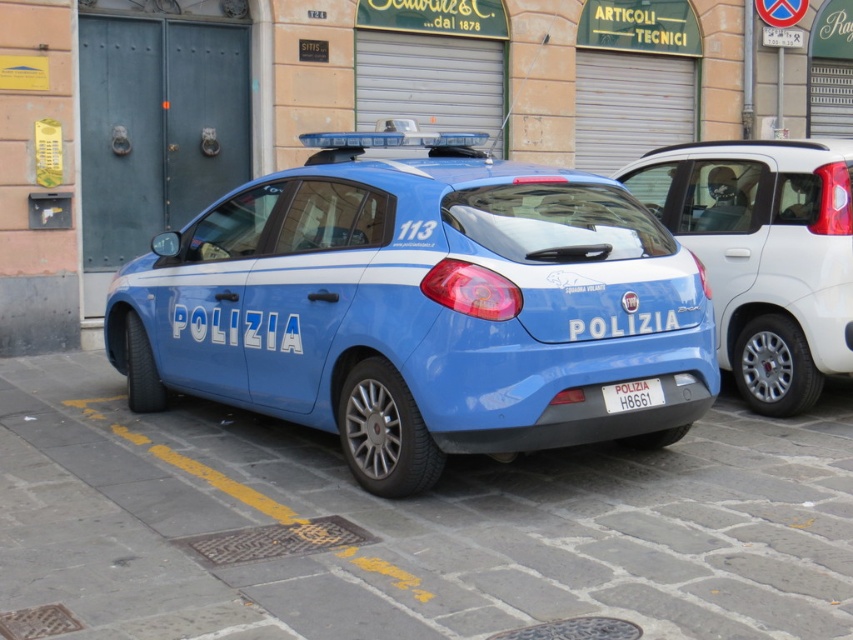
You are a pedestrian standing on the cobblestone street. You see a matte blue car at center and a blue glossy car at center. Which one is closer to you?

The matte blue car at center is closer to you because it is in front of the blue glossy car at center.

You are a delivery person who needs to park a 1.8m wide delivery van next to the matte blue car at center and the blue glossy car at center. Which car should you park next to to ensure there is enough space for the van?

The matte blue car at center has a larger width than the blue glossy car at center, so you should park next to the blue glossy car at center to ensure there is enough space for the van.